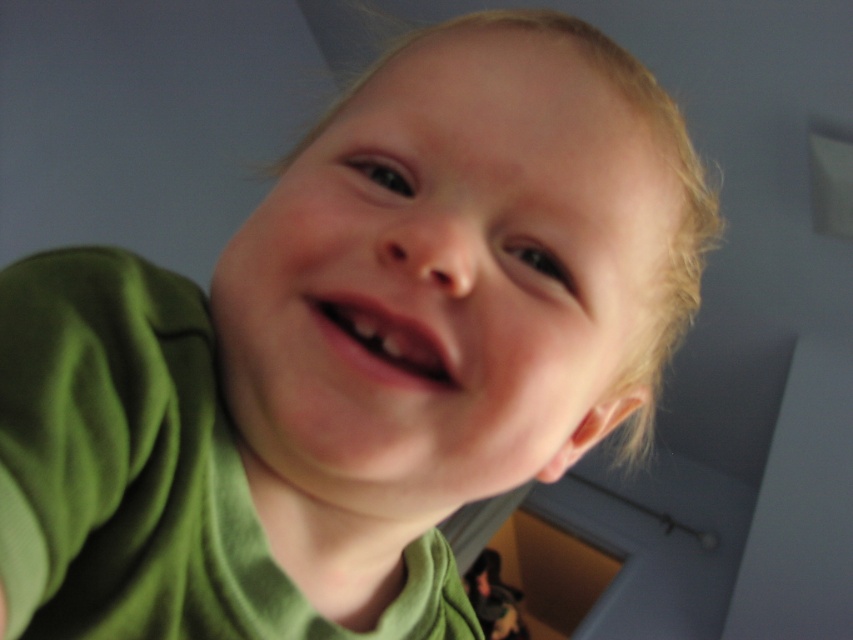
Does point (486, 432) come in front of point (404, 353)?

No, (486, 432) is further to viewer.

At what (x,y) coordinates should I click in order to perform the action: click on smooth skin face at center. Please return your answer as a coordinate pair (x, y). This screenshot has height=640, width=853. Looking at the image, I should click on 447,280.